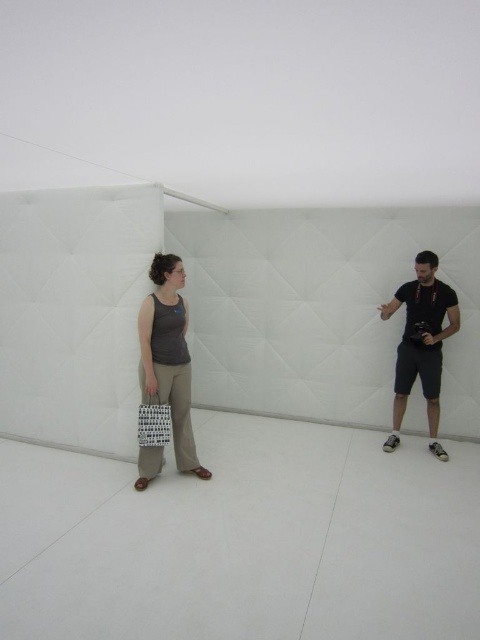
Question: Estimate the real-world distances between objects in this image. Which object is farther from the dark gray fabric camera at right?

Choices:
 (A) white matte shopping bag at center
 (B) matte gray tank top at center

Answer: (A)

Question: Is dark gray fabric camera at right above white matte shopping bag at center?

Choices:
 (A) no
 (B) yes

Answer: (B)

Question: Estimate the real-world distances between objects in this image. Which object is farther from the matte gray tank top at center?

Choices:
 (A) white matte shopping bag at center
 (B) dark gray fabric camera at right

Answer: (B)

Question: In this image, where is dark gray fabric camera at right located relative to white matte shopping bag at center?

Choices:
 (A) below
 (B) above

Answer: (B)

Question: Which of the following is the closest to the observer?

Choices:
 (A) white matte shopping bag at center
 (B) matte gray tank top at center

Answer: (B)

Question: Observing the image, what is the correct spatial positioning of matte gray tank top at center in reference to white matte shopping bag at center?

Choices:
 (A) below
 (B) above

Answer: (B)